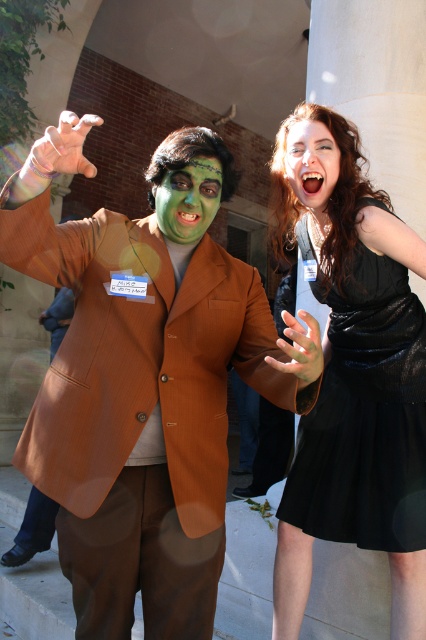
Question: Which point is farther to the camera?

Choices:
 (A) (311, 192)
 (B) (379, 349)
 (C) (201, 221)

Answer: (A)

Question: Does green matte face at center have a larger size compared to matte black hair at upper right?

Choices:
 (A) no
 (B) yes

Answer: (A)

Question: Among these objects, which one is farthest from the camera?

Choices:
 (A) green matte face at center
 (B) matte black hair at upper right
 (C) black velvet dress at right

Answer: (B)

Question: From the image, what is the correct spatial relationship of green matte face at center in relation to matte black hair at upper right?

Choices:
 (A) left
 (B) right

Answer: (A)

Question: Is black velvet dress at right positioned at the back of matte black hair at upper right?

Choices:
 (A) no
 (B) yes

Answer: (A)

Question: Among these points, which one is farthest from the camera?

Choices:
 (A) (193, 195)
 (B) (397, 536)

Answer: (B)